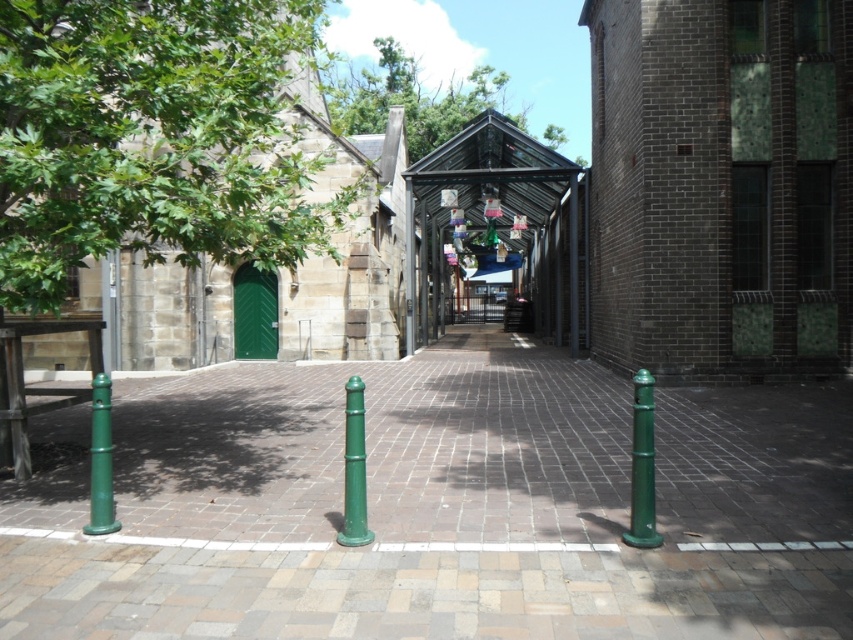
Which is more to the right, green polished concrete pavement at center or green matte post at center?

Positioned to the right is green polished concrete pavement at center.

Find the location of a particular element. green polished concrete pavement at center is located at coordinates (381, 448).

Who is lower down, smooth stone pavement at center or green leafy tree at upper center?

smooth stone pavement at center

Is smooth stone pavement at center further to camera compared to green leafy tree at upper center?

No, smooth stone pavement at center is closer to the viewer.

Is point (47, 584) closer to camera compared to point (549, 132)?

Yes, point (47, 584) is in front of point (549, 132).

Locate an element on the screen. The width and height of the screenshot is (853, 640). smooth stone pavement at center is located at coordinates (416, 593).

Based on the photo, is the position of green leafy tree at upper left more distant than that of smooth stone pavement at center?

Yes, green leafy tree at upper left is further from the viewer.

Which is below, green leafy tree at upper left or smooth stone pavement at center?

smooth stone pavement at center is below.

Between point (50, 204) and point (498, 573), which one is positioned in front?

Point (498, 573) is in front.

Where is `green leafy tree at upper left`? The width and height of the screenshot is (853, 640). green leafy tree at upper left is located at coordinates (152, 138).